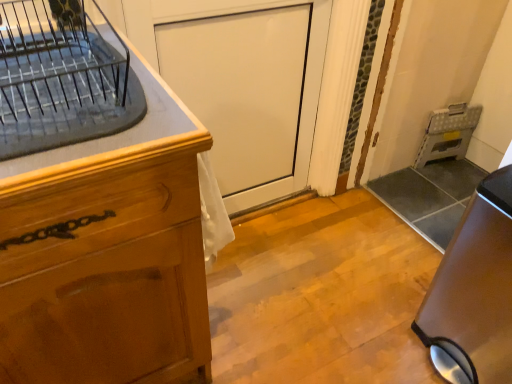
At what (x,y) coordinates should I click in order to perform the action: click on satin brown trash can at lower right. Please return your answer as a coordinate pair (x, y). The image size is (512, 384). Looking at the image, I should click on (474, 291).

The width and height of the screenshot is (512, 384). In order to click on metallic gray folding step stool at right in this screenshot , I will do `click(448, 133)`.

Measure the distance between white glossy door at center and camera.

The depth of white glossy door at center is 3.88 feet.

Describe the element at coordinates (95, 210) in the screenshot. This screenshot has height=384, width=512. I see `wooden cabinet at left` at that location.

I want to click on clear glass dish rack at upper left, so click(25, 18).

The height and width of the screenshot is (384, 512). I want to click on satin brown trash can at lower right, so click(x=474, y=291).

Does white glossy door at center turn towards clear glass dish rack at upper left?

No, white glossy door at center does not turn towards clear glass dish rack at upper left.

Can you tell me how much white glossy door at center and clear glass dish rack at upper left differ in facing direction?

The angular difference between white glossy door at center and clear glass dish rack at upper left is 0.0544 degrees.

Can you confirm if white glossy door at center is bigger than clear glass dish rack at upper left?

Yes, white glossy door at center is bigger than clear glass dish rack at upper left.

Does point (286, 179) come in front of point (96, 17)?

That is False.

Can you see white glossy door at center touching satin brown trash can at lower right?

No, white glossy door at center is not making contact with satin brown trash can at lower right.

Can you confirm if white glossy door at center is taller than satin brown trash can at lower right?

Indeed, white glossy door at center has a greater height compared to satin brown trash can at lower right.

From a real-world perspective, is white glossy door at center below satin brown trash can at lower right?

No.

Looking at this image, relative to metallic gray folding step stool at right, is white glossy door at center in front or behind?

Visually, white glossy door at center is located in front of metallic gray folding step stool at right.

What are the coordinates of `appliance behind the white glossy door at center` in the screenshot? It's located at (448, 133).

From a real-world perspective, is white glossy door at center positioned above or below metallic gray folding step stool at right?

From a real-world perspective, white glossy door at center is physically above metallic gray folding step stool at right.

Can you confirm if white glossy door at center is bigger than metallic gray folding step stool at right?

Yes, white glossy door at center is bigger than metallic gray folding step stool at right.

Does point (51, 224) come closer to viewer compared to point (489, 318)?

That is True.

Is wooden cabinet at left smaller than satin brown trash can at lower right?

Actually, wooden cabinet at left might be larger than satin brown trash can at lower right.

Measure the distance from wooden cabinet at left to satin brown trash can at lower right.

wooden cabinet at left is 35.22 inches away from satin brown trash can at lower right.

Would you say wooden cabinet at left is inside or outside satin brown trash can at lower right?

wooden cabinet at left is spatially situated outside satin brown trash can at lower right.

From the image's perspective, which one is positioned higher, wooden cabinet at left or metallic gray folding step stool at right?

From the image's view, metallic gray folding step stool at right is above.

Is wooden cabinet at left facing towards metallic gray folding step stool at right?

No, wooden cabinet at left is not aimed at metallic gray folding step stool at right.

In terms of width, does wooden cabinet at left look wider or thinner when compared to metallic gray folding step stool at right?

wooden cabinet at left is wider than metallic gray folding step stool at right.

Who is smaller, wooden cabinet at left or metallic gray folding step stool at right?

metallic gray folding step stool at right.

How different are the orientations of metallic gray folding step stool at right and white glossy door at center in degrees?

The facing directions of metallic gray folding step stool at right and white glossy door at center are 11.8 degrees apart.

Between metallic gray folding step stool at right and white glossy door at center, which one has more height?

white glossy door at center is taller.

From the image's perspective, who appears lower, metallic gray folding step stool at right or white glossy door at center?

white glossy door at center is shown below in the image.

Which is behind, point (475, 112) or point (181, 2)?

The point (475, 112) is more distant.

Looking at this image, considering their positions, is clear glass dish rack at upper left located in front of or behind metallic gray folding step stool at right?

clear glass dish rack at upper left is positioned closer to the viewer than metallic gray folding step stool at right.

Is clear glass dish rack at upper left taller or shorter than metallic gray folding step stool at right?

Clearly, clear glass dish rack at upper left is shorter compared to metallic gray folding step stool at right.

Considering the positions of objects clear glass dish rack at upper left and metallic gray folding step stool at right in the image provided, who is more to the left, clear glass dish rack at upper left or metallic gray folding step stool at right?

From the viewer's perspective, clear glass dish rack at upper left appears more on the left side.

In terms of width, does clear glass dish rack at upper left look wider or thinner when compared to metallic gray folding step stool at right?

Considering their sizes, clear glass dish rack at upper left looks broader than metallic gray folding step stool at right.

Where is `screen door beneath the clear glass dish rack at upper left (from a real-world perspective)`? Image resolution: width=512 pixels, height=384 pixels. screen door beneath the clear glass dish rack at upper left (from a real-world perspective) is located at coordinates pos(244,83).

I want to click on home appliance in front of the white glossy door at center, so click(474, 291).

Looking at this image, looking at the image, which one is located further to satin brown trash can at lower right, wooden cabinet at left or clear glass dish rack at upper left?

clear glass dish rack at upper left is further to satin brown trash can at lower right.

Consider the image. Which object lies nearer to the anchor point satin brown trash can at lower right, metallic gray folding step stool at right or clear glass dish rack at upper left?

The object closer to satin brown trash can at lower right is clear glass dish rack at upper left.

From the image, which object appears to be nearer to metallic gray folding step stool at right, white glossy door at center or clear glass dish rack at upper left?

Among the two, white glossy door at center is located nearer to metallic gray folding step stool at right.

From the image, which object appears to be nearer to metallic gray folding step stool at right, clear glass dish rack at upper left or white glossy door at center?

white glossy door at center is closer to metallic gray folding step stool at right.

Which object lies further to the anchor point clear glass dish rack at upper left, metallic gray folding step stool at right or wooden cabinet at left?

metallic gray folding step stool at right is positioned further to the anchor clear glass dish rack at upper left.

Considering their positions, is wooden cabinet at left positioned closer to white glossy door at center than satin brown trash can at lower right?

wooden cabinet at left is closer to white glossy door at center.

Estimate the real-world distances between objects in this image. Which object is closer to wooden cabinet at left, satin brown trash can at lower right or metallic gray folding step stool at right?

Based on the image, satin brown trash can at lower right appears to be nearer to wooden cabinet at left.

From the image, which object appears to be farther from white glossy door at center, satin brown trash can at lower right or wooden cabinet at left?

satin brown trash can at lower right is positioned further to the anchor white glossy door at center.

Identify the location of screen door positioned between satin brown trash can at lower right and metallic gray folding step stool at right from near to far. (244, 83).

Identify the location of home appliance between clear glass dish rack at upper left and metallic gray folding step stool at right in the front-back direction. (474, 291).

Image resolution: width=512 pixels, height=384 pixels. In order to click on countertop located between wooden cabinet at left and white glossy door at center in the depth direction in this screenshot , I will do `click(25, 18)`.

You are a GUI agent. You are given a task and a screenshot of the screen. Output one action in this format:
    pyautogui.click(x=<x>, y=<y>)
    Task: Click on the screen door between wooden cabinet at left and satin brown trash can at lower right in the horizontal direction
    
    Given the screenshot: What is the action you would take?
    pyautogui.click(x=244, y=83)